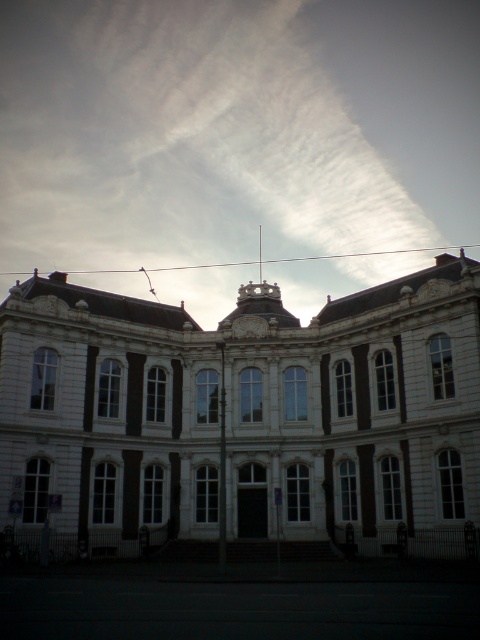
Question: Considering the real-world distances, which object is farthest from the white stone building at center?

Choices:
 (A) matte white clock at center
 (B) white cotton cloud at upper center

Answer: (B)

Question: Can you confirm if white cotton cloud at upper center is thinner than matte white clock at center?

Choices:
 (A) yes
 (B) no

Answer: (B)

Question: Which object is positioned farthest from the white cotton cloud at upper center?

Choices:
 (A) matte white clock at center
 (B) white stone building at center

Answer: (A)

Question: Does white cotton cloud at upper center appear under matte white clock at center?

Choices:
 (A) yes
 (B) no

Answer: (B)

Question: Which point is farther from the camera taking this photo?

Choices:
 (A) (278, 420)
 (B) (264, 326)

Answer: (B)

Question: Does white stone building at center appear under matte white clock at center?

Choices:
 (A) yes
 (B) no

Answer: (A)